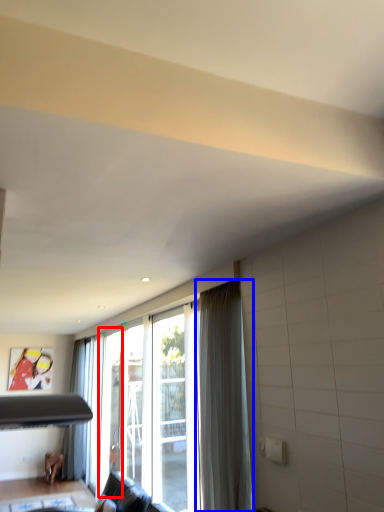
Question: Which point is further to the camera, screen door (highlighted by a red box) or curtain (highlighted by a blue box)?

Choices:
 (A) screen door
 (B) curtain

Answer: (A)